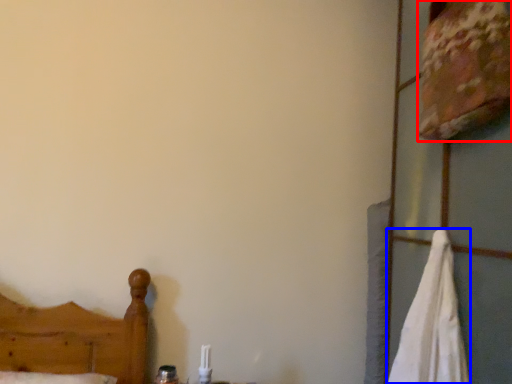
Question: Among these objects, which one is nearest to the camera, sheet (highlighted by a red box) or bath towel (highlighted by a blue box)?

Choices:
 (A) sheet
 (B) bath towel

Answer: (B)